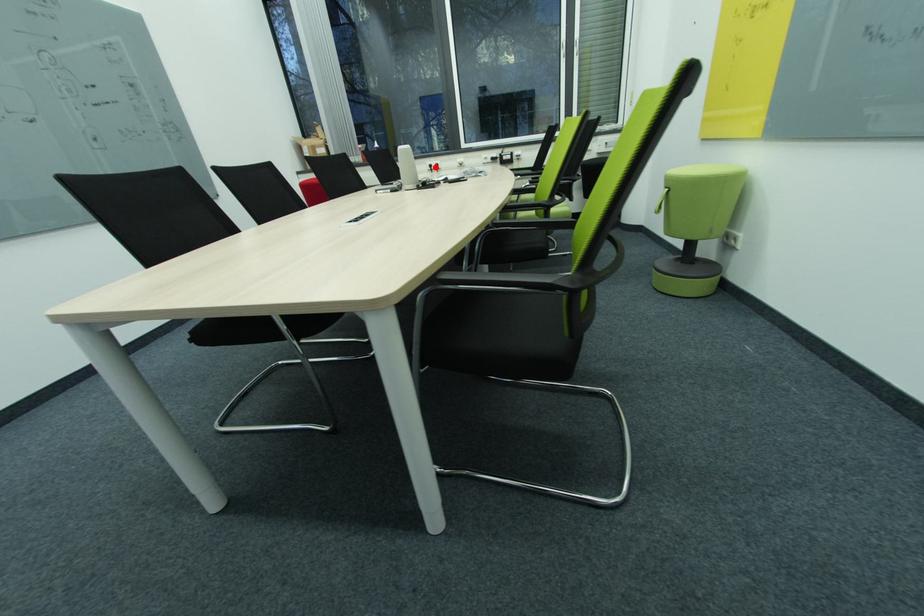
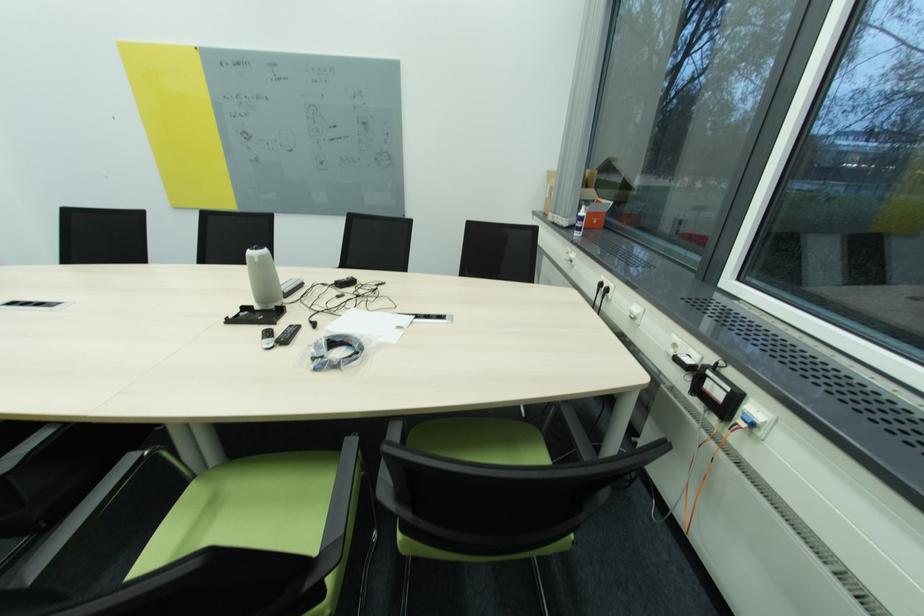
Question: I am providing you with two images of the same scene from different viewpoints. In image1, a red point is highlighted. Considering the same 3D point in image2, which of the following is correct?

Choices:
 (A) It is closer
 (B) It is farther

Answer: (A)